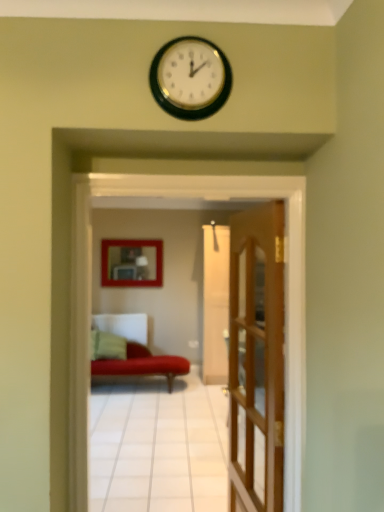
The width and height of the screenshot is (384, 512). Describe the element at coordinates (256, 359) in the screenshot. I see `wooden door at center` at that location.

What is the approximate width of green fabric pillow at lower left?

green fabric pillow at lower left is 10.00 inches wide.

Image resolution: width=384 pixels, height=512 pixels. Find the location of `velvet red couch at center`. velvet red couch at center is located at coordinates (192, 206).

Is wooden door at center far away from green fabric pillow at lower left?

Yes, wooden door at center and green fabric pillow at lower left are quite far apart.

In the image, is wooden door at center on the left side or the right side of green fabric pillow at lower left?

In the image, wooden door at center appears on the right side of green fabric pillow at lower left.

Is wooden door at center smaller than green fabric pillow at lower left?

No, wooden door at center is not smaller than green fabric pillow at lower left.

Is wooden door at center surrounding green fabric pillow at lower left?

No, green fabric pillow at lower left is not a part of wooden door at center.

Would you say wooden door at center is inside or outside matte wooden picture frame at center?

The correct answer is: outside.

Which is in front, point (262, 292) or point (133, 264)?

The point (262, 292) is closer to the camera.

Would you say wooden door at center is a long distance from matte wooden picture frame at center?

Absolutely, wooden door at center is distant from matte wooden picture frame at center.

Is velvet red couch at center bigger or smaller than matte wooden picture frame at center?

Clearly, velvet red couch at center is larger in size than matte wooden picture frame at center.

From a real-world perspective, which is physically above, velvet red couch at center or matte wooden picture frame at center?

matte wooden picture frame at center is physically above.

Considering the relative sizes of velvet red couch at center and matte wooden picture frame at center in the image provided, is velvet red couch at center taller than matte wooden picture frame at center?

Yes.

Does wooden door at center appear on the left side of velvet red couch at center?

In fact, wooden door at center is to the right of velvet red couch at center.

In the scene shown: Can we say wooden door at center lies outside velvet red couch at center?

Yes, wooden door at center is outside of velvet red couch at center.

From the picture: Which is farther from the camera, (281, 352) or (72, 372)?

The point (281, 352) is farther.

Considering the sizes of objects green fabric pillow at lower left and velvet red couch at center in the image provided, who is bigger, green fabric pillow at lower left or velvet red couch at center?

velvet red couch at center is bigger.

Would you say green fabric pillow at lower left is to the left or to the right of velvet red couch at center in the picture?

Based on their positions, green fabric pillow at lower left is located to the left of velvet red couch at center.

Which point is more forward, (125, 342) or (290, 434)?

Positioned in front is point (290, 434).

Which is further, (156, 272) or (100, 338)?

Point (156, 272)

From the image's perspective, is matte wooden picture frame at center above or below green fabric pillow at lower left?

matte wooden picture frame at center is situated higher than green fabric pillow at lower left in the image.

Considering their positions, is matte wooden picture frame at center located in front of or behind green fabric pillow at lower left?

matte wooden picture frame at center is behind green fabric pillow at lower left.

In the scene shown: Which is correct: matte wooden picture frame at center is inside green fabric pillow at lower left, or outside of it?

matte wooden picture frame at center is not inside green fabric pillow at lower left, it's outside.

How different are the orientations of green fabric pillow at lower left and wooden door at center in degrees?

The facing directions of green fabric pillow at lower left and wooden door at center are 85.8 degrees apart.

Does green fabric pillow at lower left have a smaller size compared to wooden door at center?

Correct, green fabric pillow at lower left occupies less space than wooden door at center.

Which object is positioned more to the right, green fabric pillow at lower left or wooden door at center?

wooden door at center.

Is green fabric pillow at lower left in front of wooden door at center?

No, the depth of green fabric pillow at lower left is greater than that of wooden door at center.

Locate an element on the screen. Image resolution: width=384 pixels, height=512 pixels. door located above the green fabric pillow at lower left (from the image's perspective) is located at coordinates (256, 359).

What are the coordinates of `door located underneath the matte wooden picture frame at center (from a real-world perspective)` in the screenshot? It's located at (256, 359).

Estimate the real-world distances between objects in this image. Which object is further from matte wooden picture frame at center, velvet red couch at center or green fabric pillow at lower left?

The object further to matte wooden picture frame at center is velvet red couch at center.

Looking at the image, which one is located further to matte wooden picture frame at center, green fabric pillow at lower left or velvet red couch at center?

The object further to matte wooden picture frame at center is velvet red couch at center.

From the image, which object appears to be nearer to wooden door at center, velvet red couch at center or green fabric pillow at lower left?

velvet red couch at center.

When comparing their distances from green fabric pillow at lower left, does velvet red couch at center or wooden door at center seem closer?

wooden door at center is closer to green fabric pillow at lower left.

Looking at this image, looking at the image, which one is located further to green fabric pillow at lower left, matte wooden picture frame at center or wooden door at center?

Among the two, wooden door at center is located further to green fabric pillow at lower left.

Based on their spatial positions, is wooden door at center or velvet red couch at center further from green fabric pillow at lower left?

velvet red couch at center is further to green fabric pillow at lower left.

Looking at this image, based on their spatial positions, is green fabric pillow at lower left or wooden door at center further from matte wooden picture frame at center?

wooden door at center is further to matte wooden picture frame at center.

When comparing their distances from wooden door at center, does velvet red couch at center or matte wooden picture frame at center seem further?

Based on the image, matte wooden picture frame at center appears to be further to wooden door at center.

Where is `pillow between wooden door at center and matte wooden picture frame at center from front to back`? The width and height of the screenshot is (384, 512). pillow between wooden door at center and matte wooden picture frame at center from front to back is located at coordinates (107, 346).

Locate an element on the screen. The width and height of the screenshot is (384, 512). door positioned between velvet red couch at center and matte wooden picture frame at center from near to far is located at coordinates (256, 359).

I want to click on pillow between velvet red couch at center and matte wooden picture frame at center from front to back, so pos(107,346).

Where is `door between velvet red couch at center and green fabric pillow at lower left in the front-back direction`? This screenshot has width=384, height=512. door between velvet red couch at center and green fabric pillow at lower left in the front-back direction is located at coordinates (256, 359).